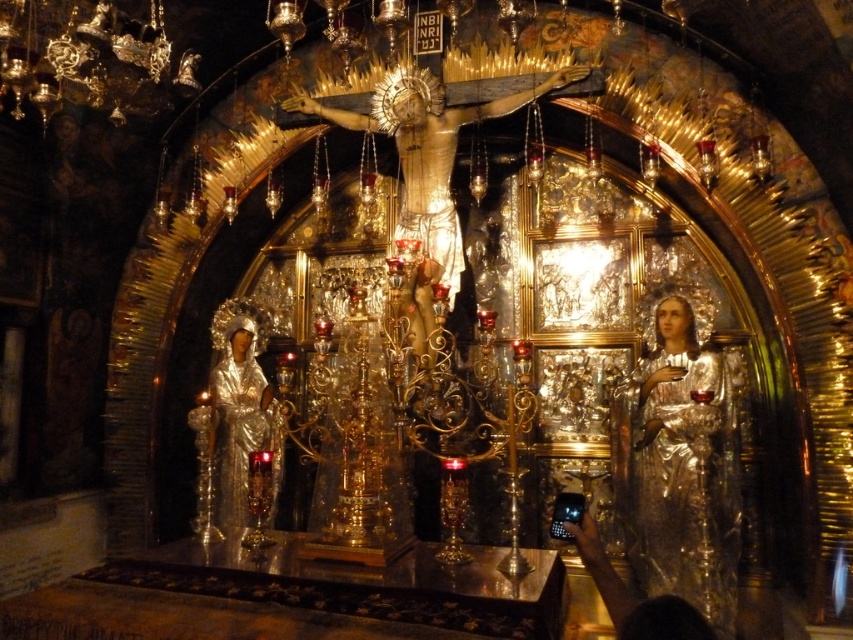
Question: Does shiny silver statue at right have a lesser width compared to gold metallic crucifix at center?

Choices:
 (A) yes
 (B) no

Answer: (A)

Question: Can you confirm if shiny silver statue at right is bigger than silver metallic statue at left?

Choices:
 (A) yes
 (B) no

Answer: (A)

Question: Based on their relative distances, which object is farther from the silver metallic statue at left?

Choices:
 (A) gold metallic crucifix at center
 (B) shiny silver statue at right

Answer: (B)

Question: Which point is farther to the camera?

Choices:
 (A) silver metallic statue at left
 (B) gold metallic crucifix at center
 (C) shiny silver statue at right

Answer: (A)

Question: Where is gold metallic crucifix at center located in relation to silver metallic statue at left in the image?

Choices:
 (A) below
 (B) above

Answer: (B)

Question: Among these points, which one is nearest to the camera?

Choices:
 (A) (721, 513)
 (B) (440, 125)

Answer: (A)